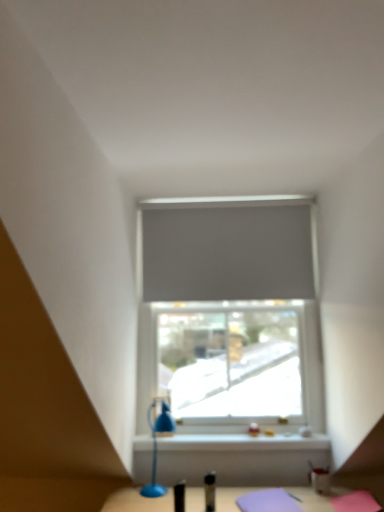
Question: Would you say matte gray roller blind at center is inside or outside gray matte curtain at center?

Choices:
 (A) outside
 (B) inside

Answer: (A)

Question: Considering their positions, is matte gray roller blind at center located in front of or behind gray matte curtain at center?

Choices:
 (A) front
 (B) behind

Answer: (A)

Question: Considering the real-world distances, which object is closest to the gray matte curtain at center?

Choices:
 (A) blue plastic table lamp at lower center
 (B) matte gray roller blind at center

Answer: (B)

Question: Considering the real-world distances, which object is farthest from the blue plastic table lamp at lower center?

Choices:
 (A) matte gray roller blind at center
 (B) gray matte curtain at center

Answer: (B)